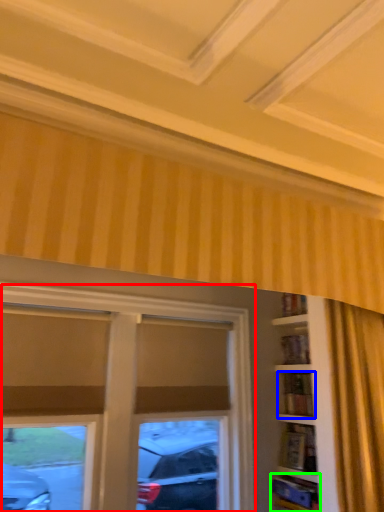
Question: Estimate the real-world distances between objects in this image. Which object is farther from window (highlighted by a red box), shelf (highlighted by a blue box) or shelf (highlighted by a green box)?

Choices:
 (A) shelf
 (B) shelf

Answer: (B)